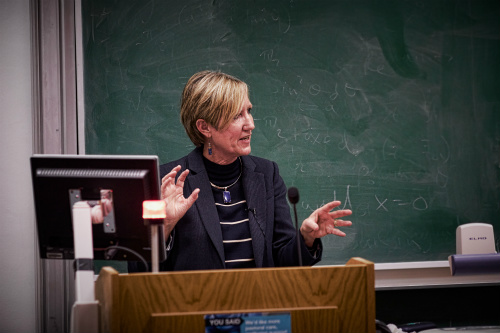
The width and height of the screenshot is (500, 333). What are the coordinates of `base of chalkboard` in the screenshot? It's located at (395, 273), (431, 275).